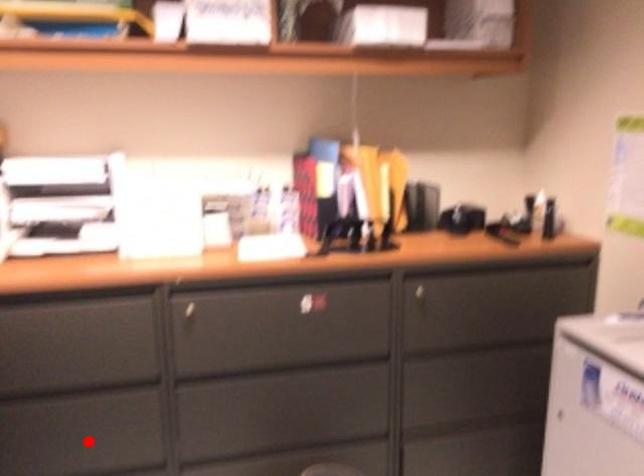
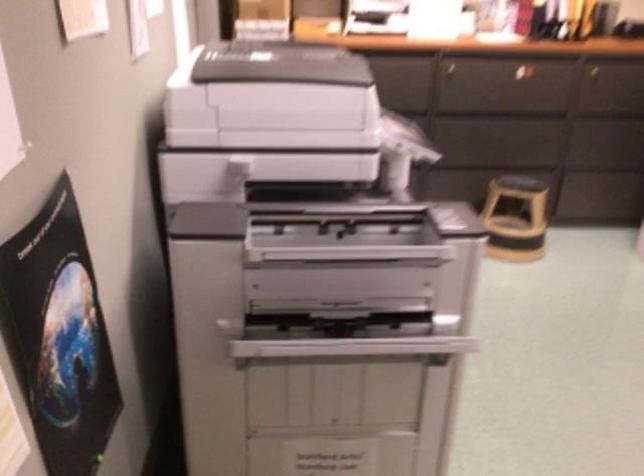
Question: I am providing you with two images of the same scene from different viewpoints. A red point is marked on the first image. Is the red point's position out of view in image 2?

Choices:
 (A) Yes
 (B) No

Answer: (A)